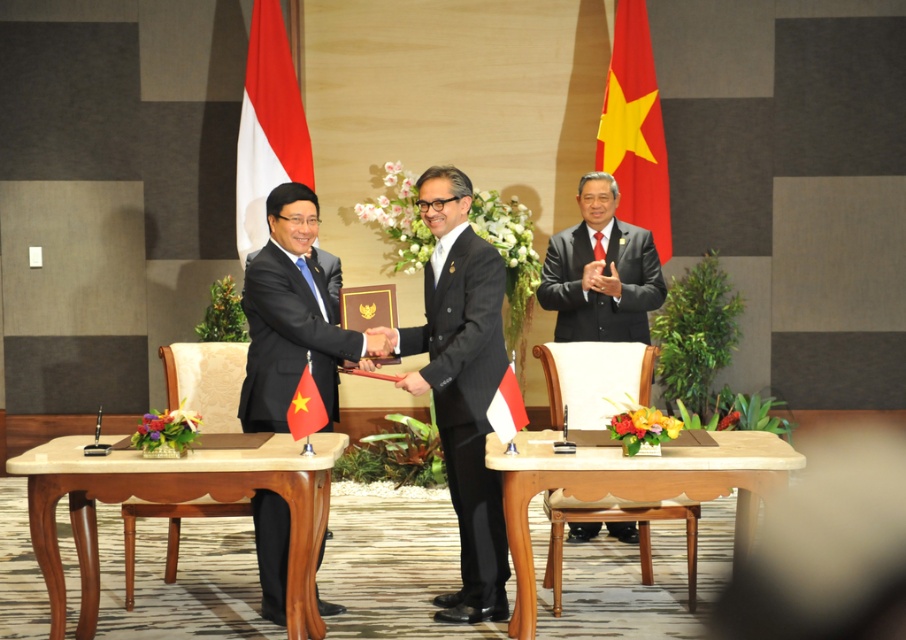
You are a photographer at this event and need to capture a photo where both the black satin suit at center and the red fabric flag at upper right are visible. Based on their sizes, which object will occupy more space in the photo?

The black satin suit at center will occupy more space in the photo because its width is larger than the red fabric flag at upper right.

You are attending a formal event and notice two items of interest in the scene. The black satin suit at center and the red fabric flag at upper right. Which item is positioned higher in the image?

The red fabric flag at upper right is positioned higher than the black satin suit at center because the black satin suit at center is below the red fabric flag at upper right.